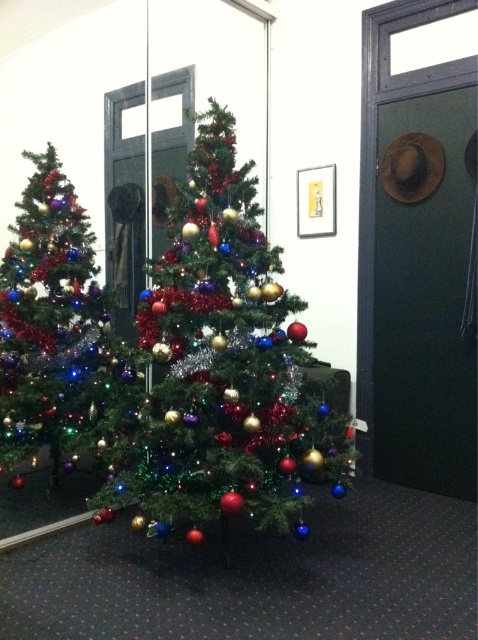
You are standing in a hallway with two Christmas trees. You need to place a gift under the tree that is on the left side. Which tree should you choose between the shiny green christmas tree at center and the shiny tinsel christmas tree at left?

The shiny tinsel christmas tree at left is on the left side, so you should place the gift under the shiny tinsel christmas tree at left.

You are planning to move both the shiny green christmas tree at center and the shiny tinsel christmas tree at left into a storage room that can only accommodate one tree at a time. Based on their widths, which tree should you move first to ensure the narrower one is moved first?

The shiny tinsel christmas tree at left is narrower than the shiny green christmas tree at center, so you should move the shiny tinsel christmas tree at left first to ensure the narrower one is moved first.

You are a delivery person standing in front of the shiny green christmas tree at center. You need to place a large package that is 1.8 meters long behind the tree. Is there enough space between you and the tree to do this?

The distance between the shiny green christmas tree at center and the viewer is 1.73 meters. Since the package is 1.8 meters long, there isn not enough space to place it behind the tree.